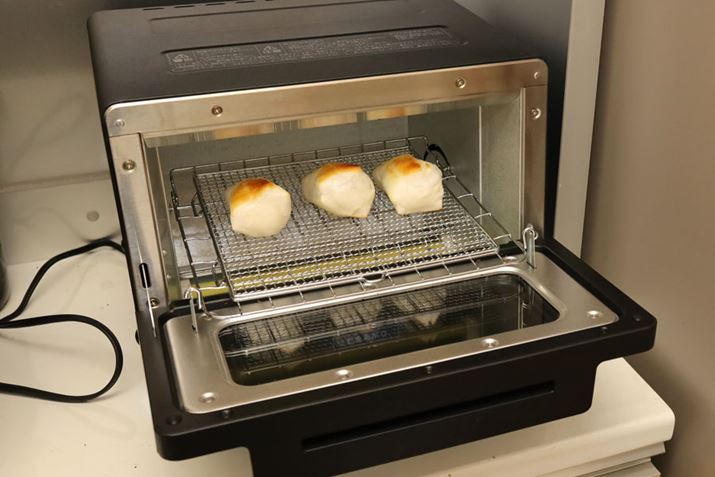
The image size is (715, 477). I want to click on grate, so click(453, 229), click(397, 144), click(197, 173), click(236, 274).